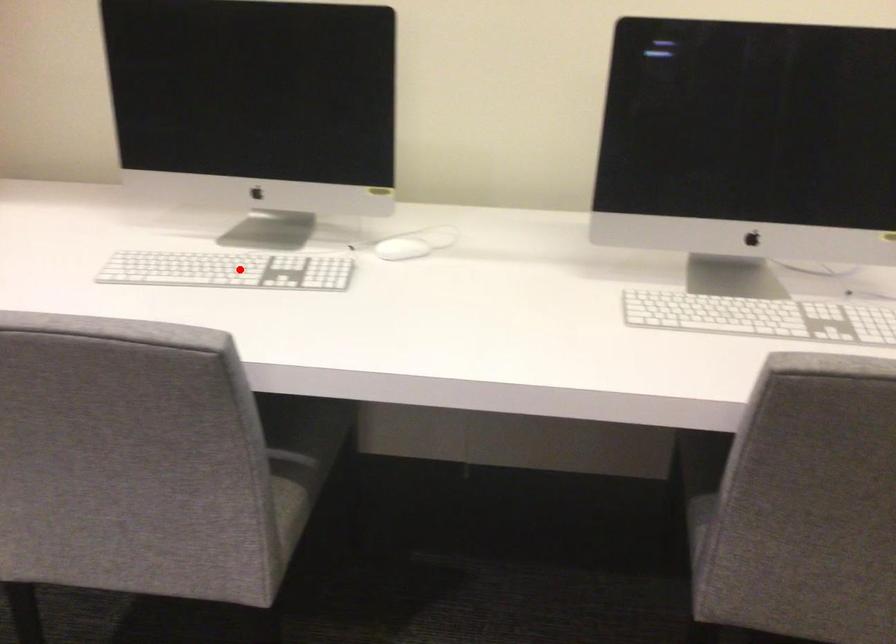
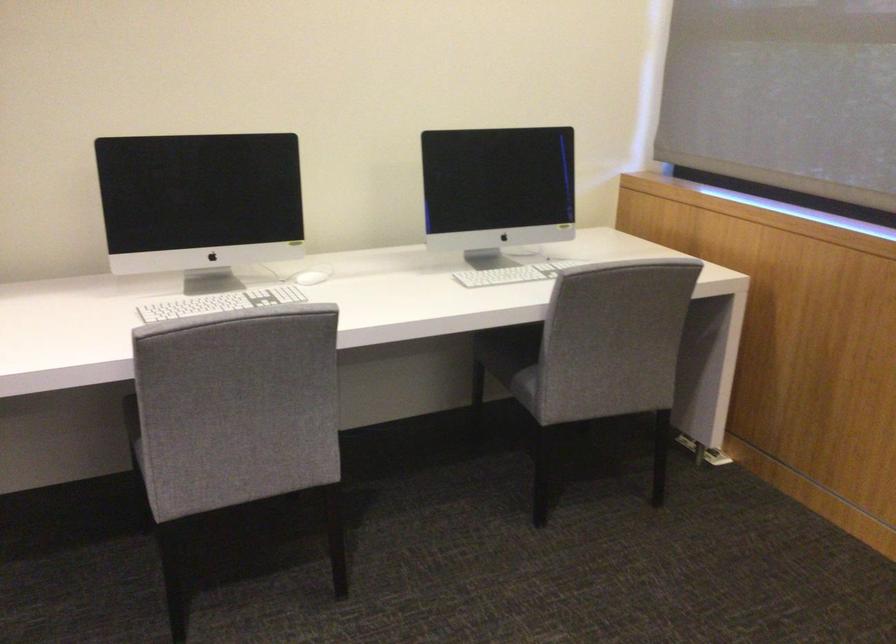
Locate, in the second image, the point that corresponds to the highlighted location in the first image.

(220, 303)